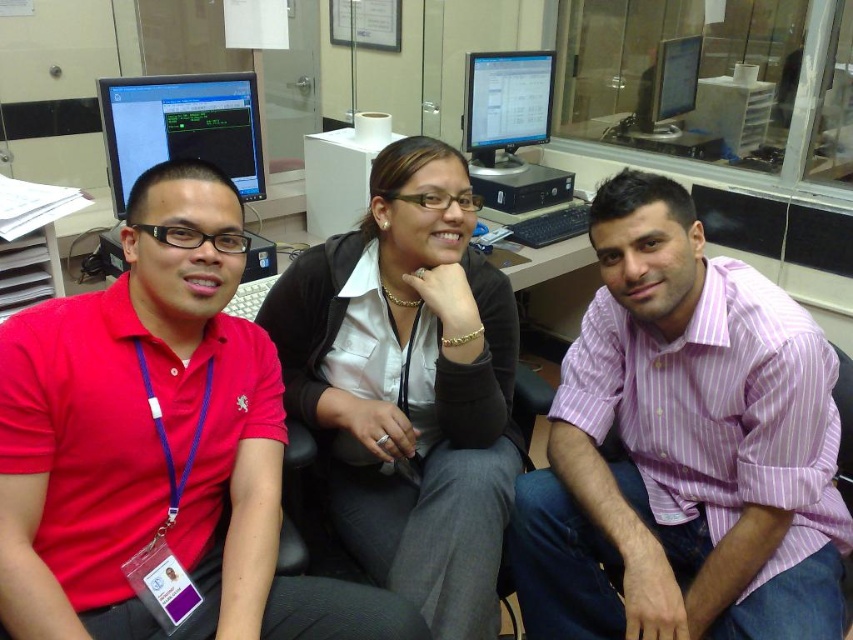
You are an office manager trying to order new uniforms for the employees. You have two samples of the shirts available. Based on the image, which shirt between the matte red polo shirt at left and the black matte shirt at center is smaller in size?

The matte red polo shirt at left is smaller in size compared to the black matte shirt at center, so the matte red polo shirt at left would be the correct sample to order if you need a smaller size.

You are an office manager checking the seating arrangement. You notice the pink striped shirt at center and the matte black monitor at center. Which object takes up more space in the image?

The pink striped shirt at center has a larger size compared to the matte black monitor at center, so it takes up more space in the image.

You are standing in the office and want to locate the matte red polo shirt at left. According to the coordinates provided, where would you find it?

The matte red polo shirt at left is located at coordinates point [155,444].